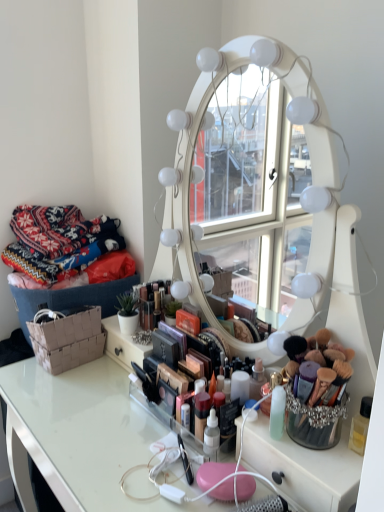
This screenshot has width=384, height=512. I want to click on free location above clear acrylic table at center (from a real-world perspective), so click(x=109, y=417).